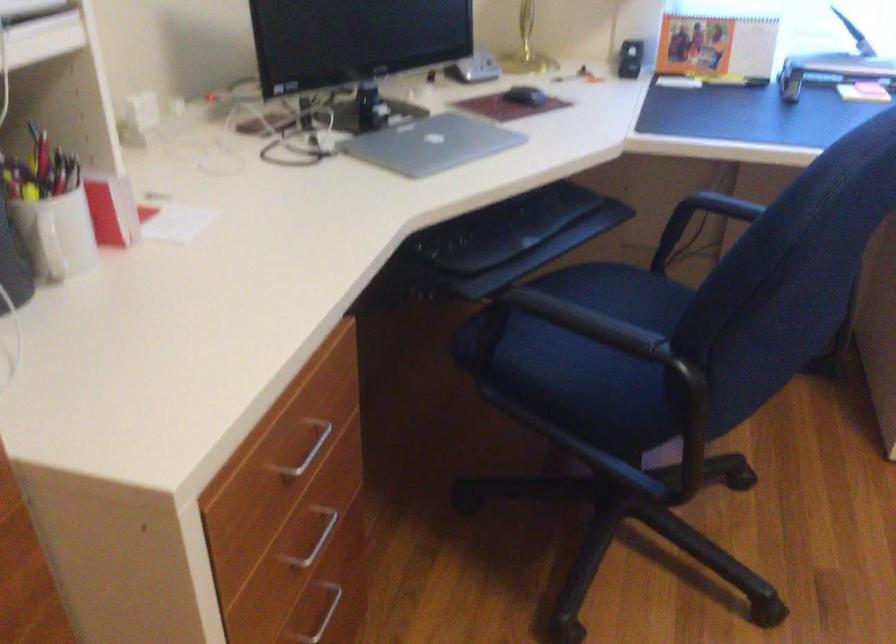
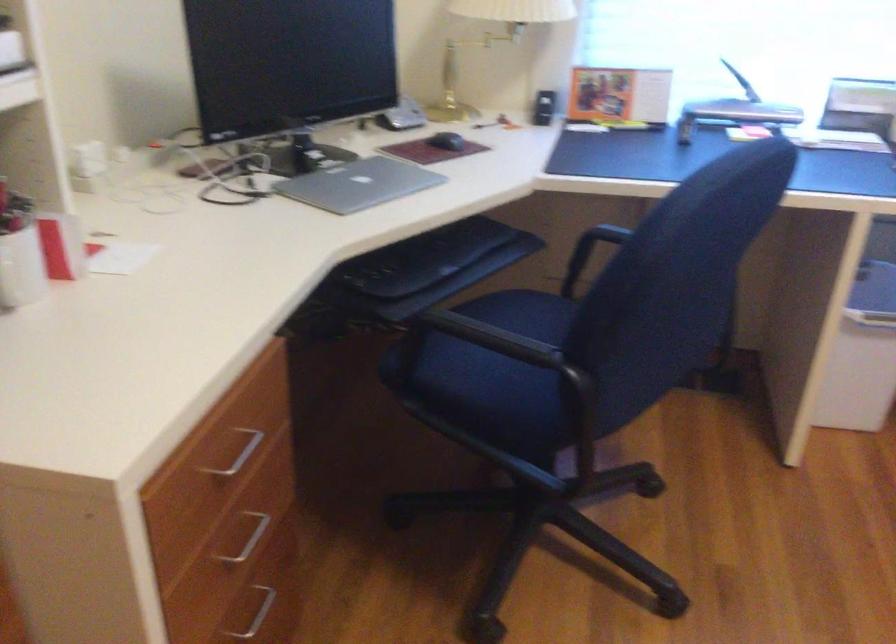
Question: The camera is either moving clockwise (left) or counter-clockwise (right) around the object. The first image is from the beginning of the video and the second image is from the end. Is the camera moving left or right when shooting the video?

Choices:
 (A) Left
 (B) Right

Answer: (A)